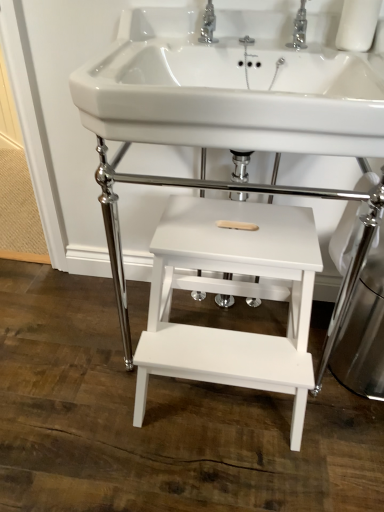
Where is `free space in front of white wood step stool at center, which appears as the first table when ordered from the bottom`? free space in front of white wood step stool at center, which appears as the first table when ordered from the bottom is located at coordinates (213, 476).